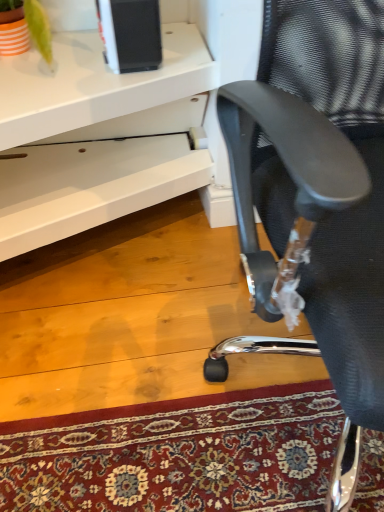
Question: Is black mesh chair at right facing away from white glossy desk at center?

Choices:
 (A) yes
 (B) no

Answer: (B)

Question: Is black mesh chair at right touching white glossy desk at center?

Choices:
 (A) yes
 (B) no

Answer: (B)

Question: From a real-world perspective, is black mesh chair at right beneath white glossy desk at center?

Choices:
 (A) yes
 (B) no

Answer: (B)

Question: Can you confirm if black mesh chair at right is wider than white glossy desk at center?

Choices:
 (A) no
 (B) yes

Answer: (A)

Question: Considering the relative sizes of black mesh chair at right and white glossy desk at center in the image provided, is black mesh chair at right taller than white glossy desk at center?

Choices:
 (A) no
 (B) yes

Answer: (B)

Question: Is black mesh chair at right at the right side of white glossy desk at center?

Choices:
 (A) yes
 (B) no

Answer: (A)

Question: Is white glossy desk at center taller than black mesh chair at right?

Choices:
 (A) yes
 (B) no

Answer: (B)

Question: Can you confirm if white glossy desk at center is shorter than black mesh chair at right?

Choices:
 (A) yes
 (B) no

Answer: (A)

Question: From a real-world perspective, is white glossy desk at center under black mesh chair at right?

Choices:
 (A) no
 (B) yes

Answer: (B)

Question: Is white glossy desk at center positioned far away from black mesh chair at right?

Choices:
 (A) yes
 (B) no

Answer: (B)

Question: Is white glossy desk at center surrounding black mesh chair at right?

Choices:
 (A) no
 (B) yes

Answer: (A)

Question: From the image's perspective, is white glossy desk at center over black mesh chair at right?

Choices:
 (A) no
 (B) yes

Answer: (B)

Question: Based on their positions, is black mesh chair at right located to the left or right of white glossy desk at center?

Choices:
 (A) left
 (B) right

Answer: (B)